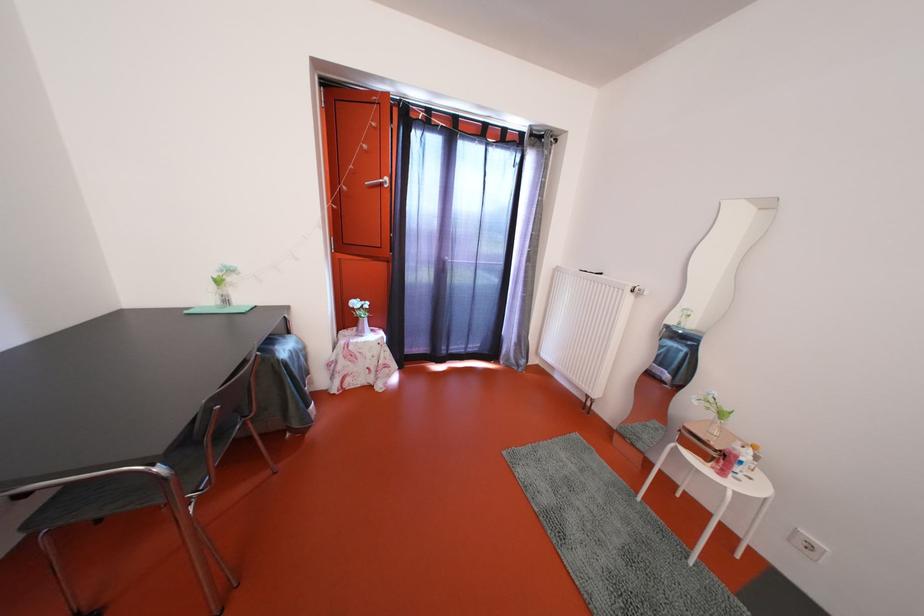
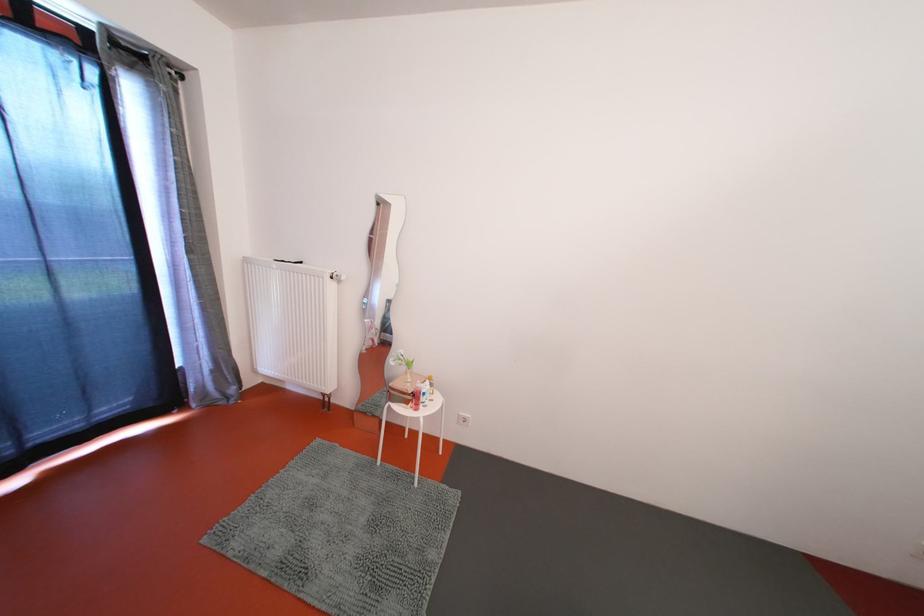
Locate, in the second image, the point that corresponds to point (609, 280) in the first image.

(309, 268)